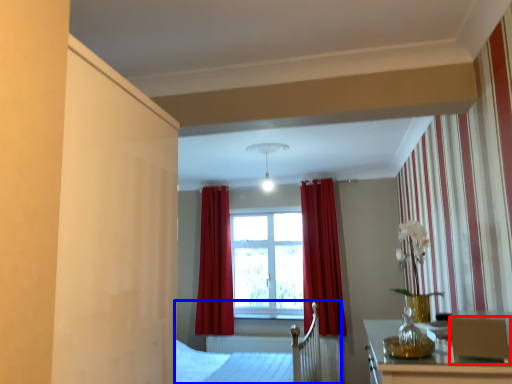
Question: Which object appears farthest to the camera in this image, armchair (highlighted by a red box) or bed frame (highlighted by a blue box)?

Choices:
 (A) armchair
 (B) bed frame

Answer: (B)